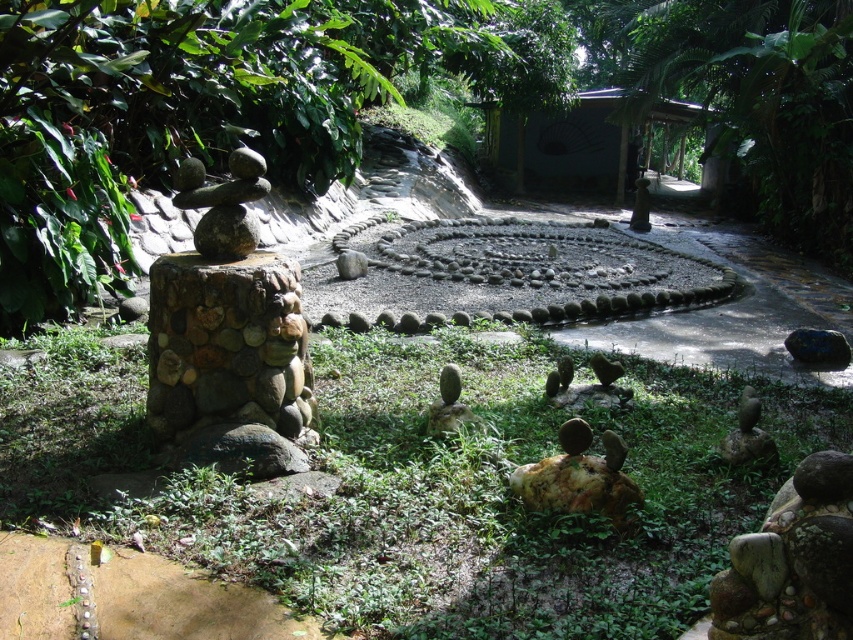
Question: Among these points, which one is nearest to the camera?

Choices:
 (A) (189, 172)
 (B) (190, 198)

Answer: (B)

Question: Which of the following is the closest to the observer?

Choices:
 (A) smooth brown rock stack at center-left
 (B) rustic stone sculpture at left

Answer: (B)

Question: Is rustic stone sculpture at left positioned behind smooth brown rock stack at center-left?

Choices:
 (A) no
 (B) yes

Answer: (A)

Question: Which point appears closest to the camera in this image?

Choices:
 (A) (225, 262)
 (B) (252, 241)

Answer: (A)

Question: Does rustic stone sculpture at left lie behind smooth brown rock stack at center-left?

Choices:
 (A) yes
 (B) no

Answer: (B)

Question: Does rustic stone sculpture at left appear on the left side of smooth brown rock stack at center-left?

Choices:
 (A) yes
 (B) no

Answer: (B)